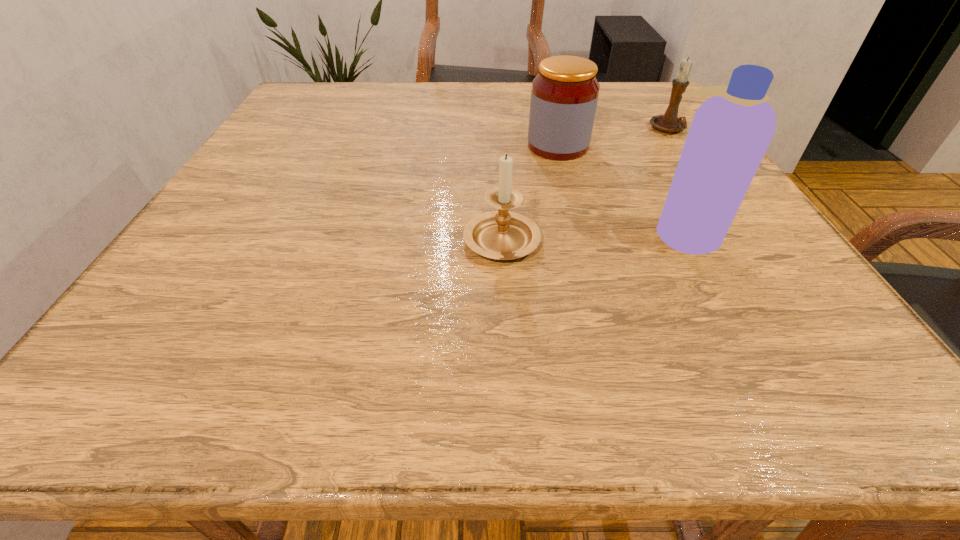
Where is `the second closest object to the leftmost object`? The image size is (960, 540). the second closest object to the leftmost object is located at coordinates (730, 132).

Locate an element on the screen. vacant area that satisfies the following two spatial constraints: 1. with a handle on the side of the leftmost object; 2. on the left side of the jar is located at coordinates pyautogui.click(x=496, y=146).

Image resolution: width=960 pixels, height=540 pixels. What are the coordinates of `free spot that satisfies the following two spatial constraints: 1. with a handle on the side of the leftmost object; 2. on the left side of the tallest object` in the screenshot? It's located at (x=501, y=233).

Find the location of `vacant space that satisfies the following two spatial constraints: 1. on the front side of the jar; 2. on the left side of the shampoo`. vacant space that satisfies the following two spatial constraints: 1. on the front side of the jar; 2. on the left side of the shampoo is located at coordinates (581, 233).

This screenshot has height=540, width=960. Find the location of `vacant region that satisfies the following two spatial constraints: 1. with a handle on the side of the left candle holder; 2. on the right side of the second object from left to right`. vacant region that satisfies the following two spatial constraints: 1. with a handle on the side of the left candle holder; 2. on the right side of the second object from left to right is located at coordinates (496, 146).

Find the location of a particular element. vacant point that satisfies the following two spatial constraints: 1. with a handle on the side of the left candle holder; 2. on the right side of the tallest object is located at coordinates (501, 233).